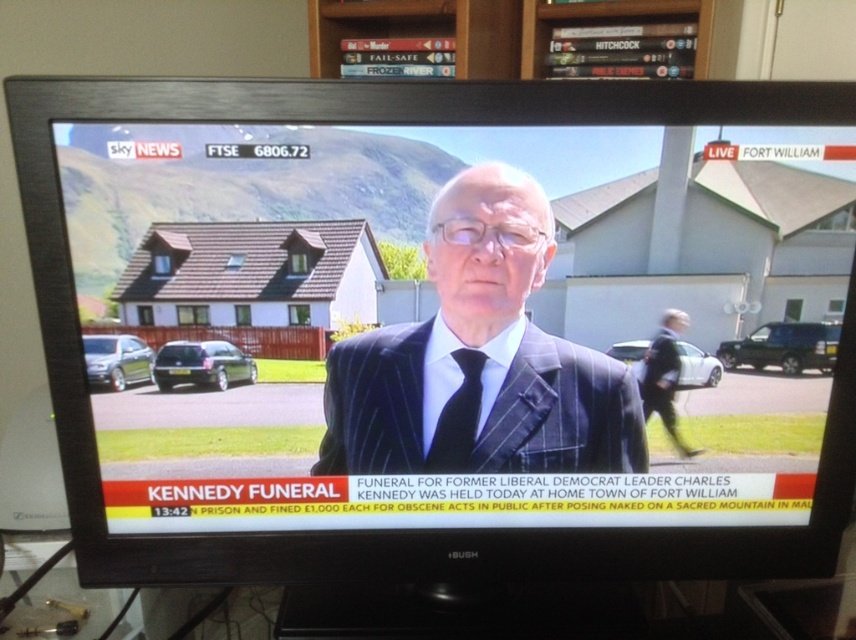
Is pinstriped suit at center bigger than black silk tie at center?

Correct, pinstriped suit at center is larger in size than black silk tie at center.

In the scene shown: Between pinstriped suit at center and black silk tie at center, which one appears on the left side from the viewer's perspective?

From the viewer's perspective, black silk tie at center appears more on the left side.

What are the coordinates of `pinstriped suit at center` in the screenshot? It's located at (479, 358).

Locate an element on the screen. pinstriped suit at center is located at coordinates (479, 358).